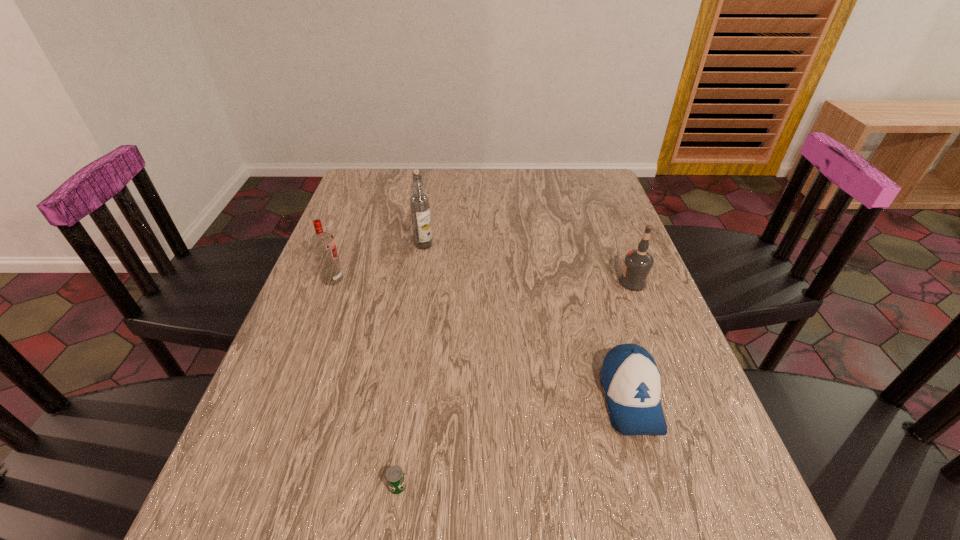
You are a GUI agent. You are given a task and a screenshot of the screen. Output one action in this format:
    pyautogui.click(x=<x>, y=<y>)
    Task: Click on the free space that satisfies the following two spatial constraints: 1. on the front label of the shortest object; 2. on the left side of the leftmost vodka
    Image resolution: width=960 pixels, height=540 pixels.
    Given the screenshot: What is the action you would take?
    pos(253,486)

Where is `free spot that satisfies the following two spatial constraints: 1. on the front label of the rightmost object; 2. on the front side of the beer can`? free spot that satisfies the following two spatial constraints: 1. on the front label of the rightmost object; 2. on the front side of the beer can is located at coordinates (712, 486).

Identify the location of free space that satisfies the following two spatial constraints: 1. on the front label of the leftmost vodka; 2. on the right side of the shortest object. (253, 486).

Where is `vacant position in the image that satisfies the following two spatial constraints: 1. on the front label of the leftmost vodka; 2. on the right side of the nearest object`? The height and width of the screenshot is (540, 960). vacant position in the image that satisfies the following two spatial constraints: 1. on the front label of the leftmost vodka; 2. on the right side of the nearest object is located at coordinates (253, 486).

Locate an element on the screen. vacant space that satisfies the following two spatial constraints: 1. on the front label of the rightmost vodka; 2. on the front-facing side of the second object from right to left is located at coordinates (678, 399).